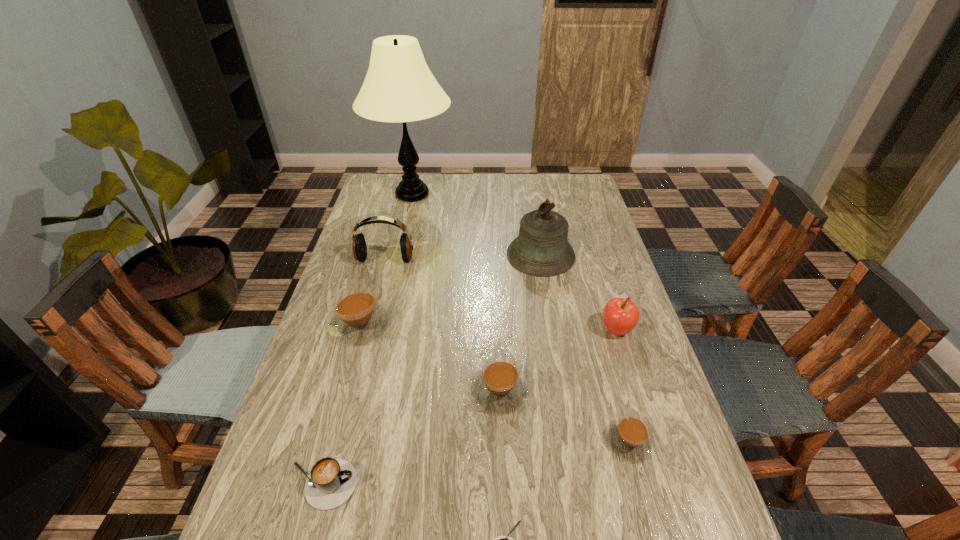
Find the location of a particular element. black lamp is located at coordinates (399, 87).

Where is `the tallest object`? the tallest object is located at coordinates (399, 87).

The image size is (960, 540). Identify the location of bell. (541, 249).

This screenshot has width=960, height=540. Identify the location of the third tallest object. (359, 247).

This screenshot has height=540, width=960. Find the location of `pink apple`. pink apple is located at coordinates (620, 315).

Find the location of a particular element. the fourth tallest object is located at coordinates (620, 315).

At what (x,y) coordinates should I click in order to perform the action: click on the tallest cappuccino. Please return your answer as a coordinate pair (x, y). The height and width of the screenshot is (540, 960). Looking at the image, I should click on (358, 318).

You are a GUI agent. You are given a task and a screenshot of the screen. Output one action in this format:
    pyautogui.click(x=<x>, y=<y>)
    Task: Click on the leftmost brown cappuccino
    This screenshot has height=540, width=960.
    Given the screenshot: What is the action you would take?
    pyautogui.click(x=358, y=318)

This screenshot has width=960, height=540. What are the coordinates of `the sixth tallest object` in the screenshot? It's located at (500, 387).

The image size is (960, 540). I want to click on the second smallest brown cappuccino, so click(x=500, y=387).